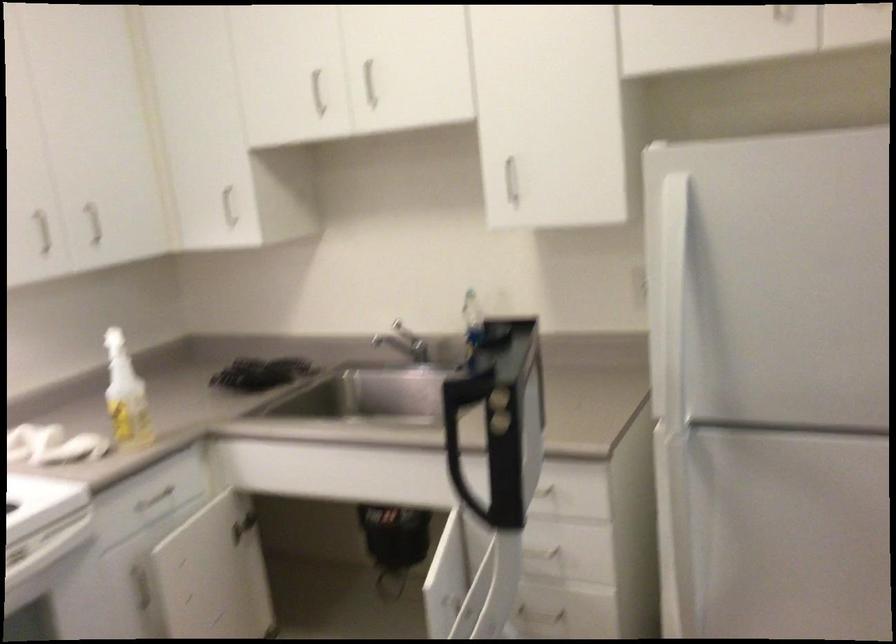
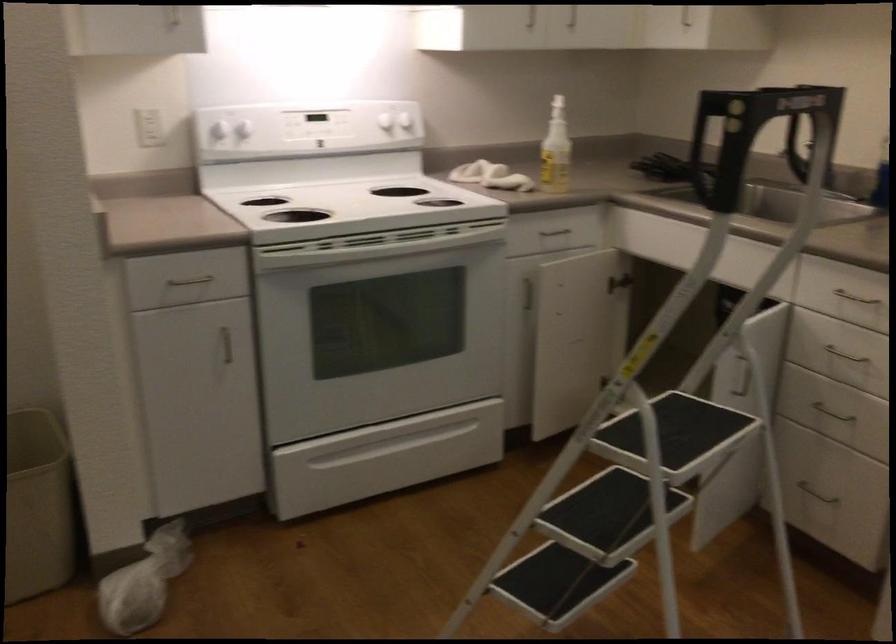
Where in the second image is the point corresponding to (100,245) from the first image?

(573, 24)